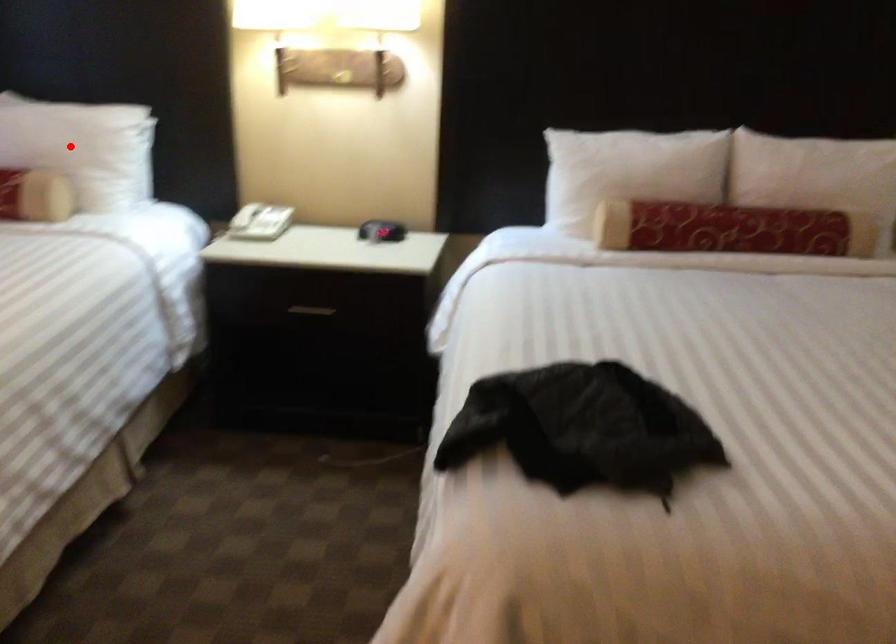
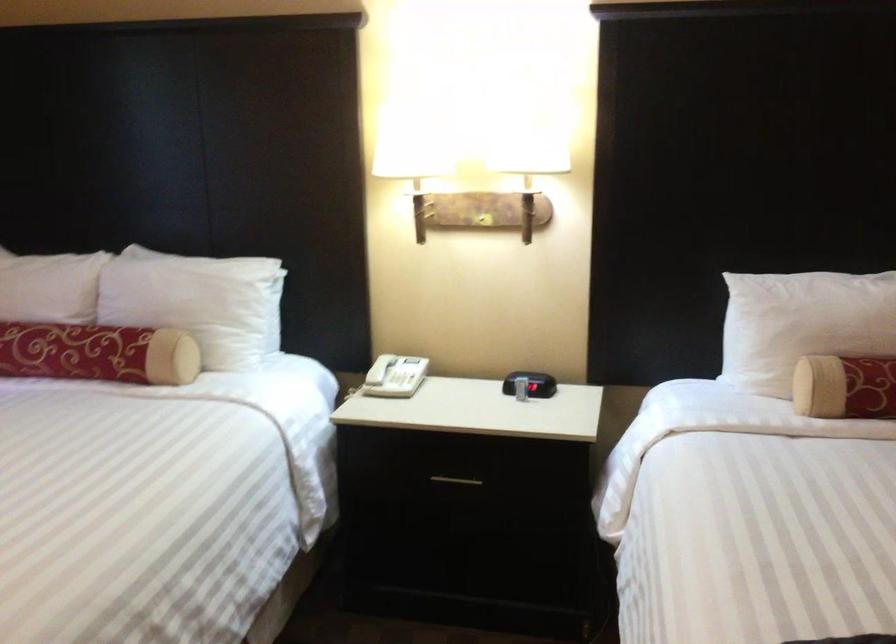
In the second image, find the point that corresponds to the highlighted location in the first image.

(197, 301)